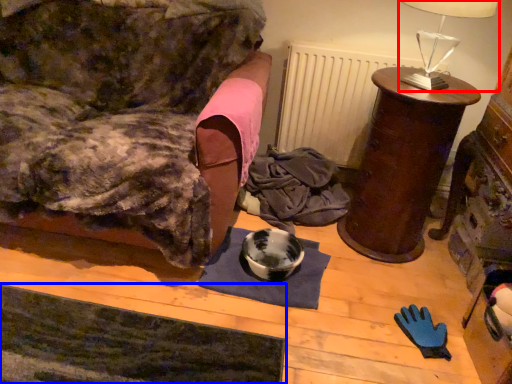
Question: Which object is further to the camera taking this photo, table lamp (highlighted by a red box) or yoga mat (highlighted by a blue box)?

Choices:
 (A) table lamp
 (B) yoga mat

Answer: (A)